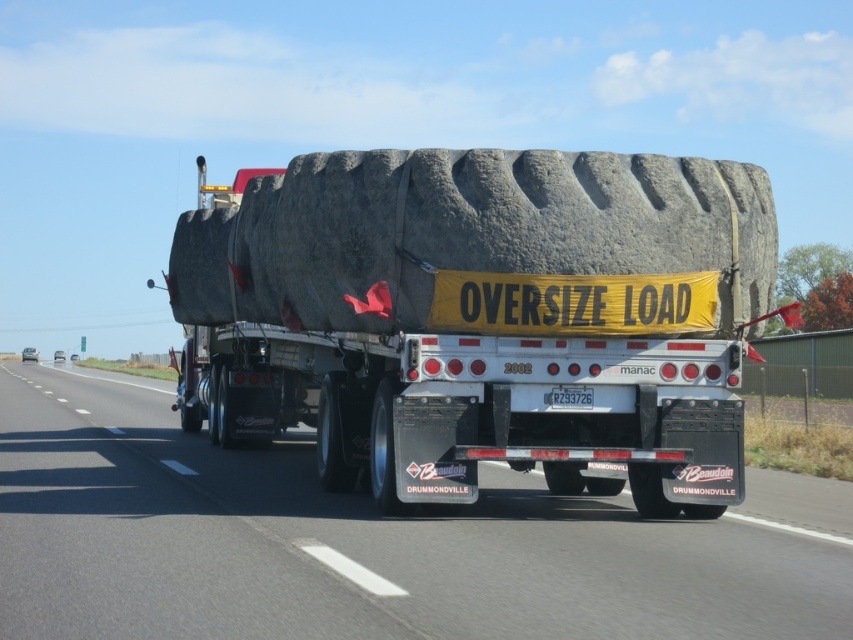
Who is positioned more to the left, rubber tire at center or black rubber tire at center?

Positioned to the left is black rubber tire at center.

Who is taller, rubber tire at center or black rubber tire at center?

rubber tire at center

Is point (682, 400) positioned after point (317, 636)?

Yes, it is behind point (317, 636).

Locate an element on the screen. This screenshot has width=853, height=640. rubber tire at center is located at coordinates (485, 317).